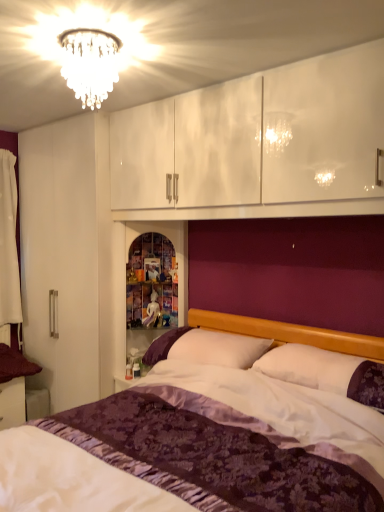
Describe the element at coordinates (214, 430) in the screenshot. Image resolution: width=384 pixels, height=512 pixels. I see `purple satin bed at center` at that location.

Describe the element at coordinates (90, 64) in the screenshot. I see `crystal chandelier at upper center` at that location.

Where is `white fabric curtain at left`? The height and width of the screenshot is (512, 384). white fabric curtain at left is located at coordinates (9, 243).

From a real-world perspective, is purple satin bed at center located beneath white soft pillow at center?

Correct, in the physical world, purple satin bed at center is lower than white soft pillow at center.

Does purple satin bed at center appear on the right side of white soft pillow at center?

No.

From the image's perspective, which is below, purple satin bed at center or white soft pillow at center?

purple satin bed at center appears lower in the image.

Is white fabric curtain at left positioned before crystal chandelier at upper center?

No, the depth of white fabric curtain at left is greater than that of crystal chandelier at upper center.

Who is shorter, white fabric curtain at left or crystal chandelier at upper center?

crystal chandelier at upper center.

From the image's perspective, who appears lower, white fabric curtain at left or crystal chandelier at upper center?

white fabric curtain at left appears lower in the image.

From a real-world perspective, is purple satin bed at center over crystal chandelier at upper center?

→ No.

Considering the sizes of objects purple satin bed at center and crystal chandelier at upper center in the image provided, who is taller, purple satin bed at center or crystal chandelier at upper center?

purple satin bed at center is taller.

Who is smaller, purple satin bed at center or crystal chandelier at upper center?

crystal chandelier at upper center.

Is the position of white fabric curtain at left less distant than that of white soft pillow at center?

No.

From a real-world perspective, is white fabric curtain at left on top of white soft pillow at center?

Yes, from a real-world perspective, white fabric curtain at left is above white soft pillow at center.

Does white soft pillow at center have a lesser width compared to purple satin bed at center?

Yes.

Measure the distance between white soft pillow at center and purple satin bed at center.

white soft pillow at center is 30.36 centimeters away from purple satin bed at center.

Who is more distant, white soft pillow at center or purple satin bed at center?

white soft pillow at center is behind.

Based on the photo, who is bigger, white soft pillow at center or purple satin bed at center?

purple satin bed at center.

Does white soft pillow at center have a greater width compared to crystal chandelier at upper center?

Yes, white soft pillow at center is wider than crystal chandelier at upper center.

Is point (363, 360) farther from camera compared to point (85, 78)?

No.

Can you confirm if white soft pillow at center is bigger than crystal chandelier at upper center?

Yes.

Considering the positions of objects white soft pillow at center and crystal chandelier at upper center in the image provided, who is behind, white soft pillow at center or crystal chandelier at upper center?

Positioned behind is white soft pillow at center.

Does crystal chandelier at upper center appear on the right side of purple satin bed at center?

No, crystal chandelier at upper center is not to the right of purple satin bed at center.

Which object is thinner, crystal chandelier at upper center or purple satin bed at center?

crystal chandelier at upper center is thinner.

What's the angular difference between crystal chandelier at upper center and purple satin bed at center's facing directions?

They differ by 1.22 degrees in their facing directions.

Looking at this image, relative to purple satin bed at center, is crystal chandelier at upper center in front or behind?

Clearly, crystal chandelier at upper center is behind purple satin bed at center.

Find the location of a particular element. pillow located above the purple satin bed at center (from the image's perspective) is located at coordinates (326, 372).

I want to click on curtain on the left of crystal chandelier at upper center, so click(9, 243).

Considering their positions, is white soft pillow at center positioned further to crystal chandelier at upper center than white fabric curtain at left?

white soft pillow at center.

When comparing their distances from white soft pillow at center, does purple satin bed at center or crystal chandelier at upper center seem closer?

purple satin bed at center lies closer to white soft pillow at center than the other object.

When comparing their distances from purple satin bed at center, does crystal chandelier at upper center or white soft pillow at center seem further?

Among the two, crystal chandelier at upper center is located further to purple satin bed at center.

Looking at this image, looking at the image, which one is located further to purple satin bed at center, crystal chandelier at upper center or white fabric curtain at left?

Based on the image, white fabric curtain at left appears to be further to purple satin bed at center.

Considering their positions, is crystal chandelier at upper center positioned further to white soft pillow at center than purple satin bed at center?

The object further to white soft pillow at center is crystal chandelier at upper center.

Estimate the real-world distances between objects in this image. Which object is further from purple satin bed at center, white fabric curtain at left or crystal chandelier at upper center?

Among the two, white fabric curtain at left is located further to purple satin bed at center.

Which object lies further to the anchor point white fabric curtain at left, purple satin bed at center or white soft pillow at center?

white soft pillow at center.

Considering their positions, is purple satin bed at center positioned further to crystal chandelier at upper center than white soft pillow at center?

white soft pillow at center is positioned further to the anchor crystal chandelier at upper center.

Locate an element on the screen. This screenshot has width=384, height=512. fixture situated between white fabric curtain at left and white soft pillow at center from left to right is located at coordinates pos(90,64).

The image size is (384, 512). In order to click on pillow between purple satin bed at center and white fabric curtain at left along the z-axis in this screenshot , I will do `click(326, 372)`.

You are a GUI agent. You are given a task and a screenshot of the screen. Output one action in this format:
    pyautogui.click(x=<x>, y=<y>)
    Task: Click on the pillow between crystal chandelier at upper center and purple satin bed at center in the up-down direction
    The width and height of the screenshot is (384, 512).
    Given the screenshot: What is the action you would take?
    pyautogui.click(x=326, y=372)

Where is `fixture positioned between purple satin bed at center and white fabric curtain at left from near to far`? This screenshot has width=384, height=512. fixture positioned between purple satin bed at center and white fabric curtain at left from near to far is located at coordinates (90, 64).